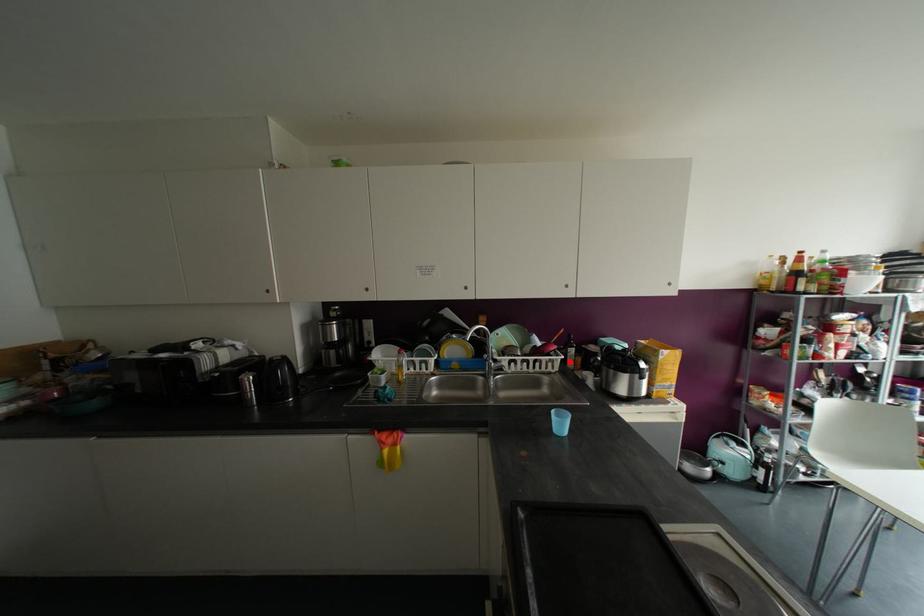
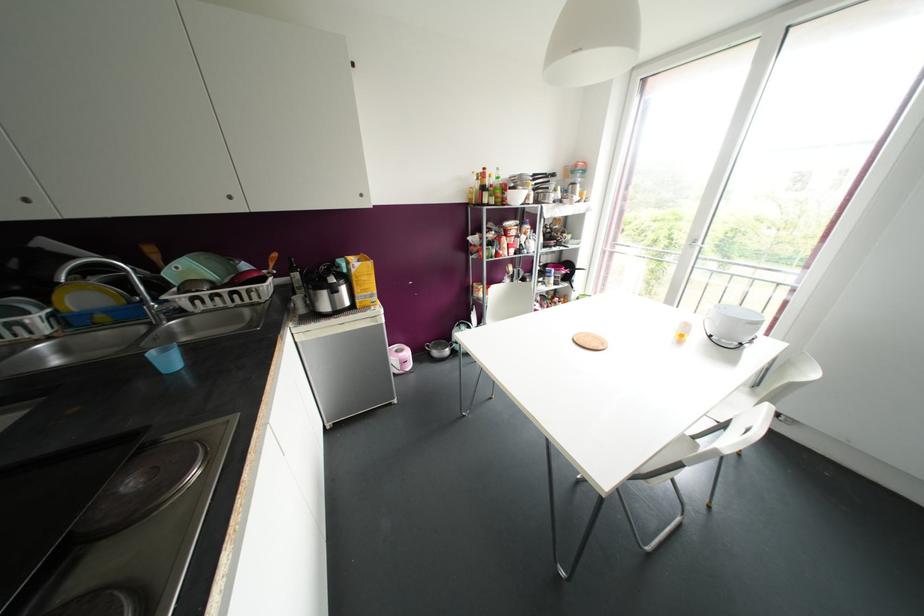
Locate, in the second image, the point that corresponds to the highlighted location in the first image.

(298, 286)